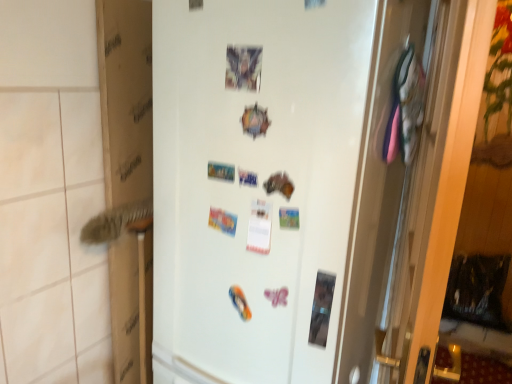
Question: Does cardboard at left have a greater width compared to white matte refrigerator at center?

Choices:
 (A) no
 (B) yes

Answer: (A)

Question: Can we say cardboard at left lies outside white matte refrigerator at center?

Choices:
 (A) no
 (B) yes

Answer: (B)

Question: Considering the relative sizes of cardboard at left and white matte refrigerator at center in the image provided, is cardboard at left smaller than white matte refrigerator at center?

Choices:
 (A) yes
 (B) no

Answer: (A)

Question: From a real-world perspective, is cardboard at left positioned under white matte refrigerator at center based on gravity?

Choices:
 (A) no
 (B) yes

Answer: (A)

Question: Is cardboard at left further to camera compared to white matte refrigerator at center?

Choices:
 (A) no
 (B) yes

Answer: (B)

Question: Is cardboard at left taller or shorter than matte plastic postcard at upper center?

Choices:
 (A) short
 (B) tall

Answer: (B)

Question: Is cardboard at left inside or outside of matte plastic postcard at upper center?

Choices:
 (A) inside
 (B) outside

Answer: (B)

Question: In terms of width, does cardboard at left look wider or thinner when compared to matte plastic postcard at upper center?

Choices:
 (A) wide
 (B) thin

Answer: (A)

Question: From the image's perspective, is cardboard at left located above or below matte plastic postcard at upper center?

Choices:
 (A) above
 (B) below

Answer: (B)

Question: Choose the correct answer: Is matte plastic postcard at upper center inside white matte refrigerator at center or outside it?

Choices:
 (A) outside
 (B) inside

Answer: (B)

Question: From the image's perspective, is matte plastic postcard at upper center above or below white matte refrigerator at center?

Choices:
 (A) above
 (B) below

Answer: (A)

Question: From their relative heights in the image, would you say matte plastic postcard at upper center is taller or shorter than white matte refrigerator at center?

Choices:
 (A) tall
 (B) short

Answer: (B)

Question: Does point (231, 79) appear closer or farther from the camera than point (218, 309)?

Choices:
 (A) closer
 (B) farther

Answer: (A)

Question: Would you say cardboard at left is to the left or to the right of white matte refrigerator at center in the picture?

Choices:
 (A) right
 (B) left

Answer: (B)

Question: Does point (119, 329) appear closer or farther from the camera than point (181, 253)?

Choices:
 (A) closer
 (B) farther

Answer: (B)